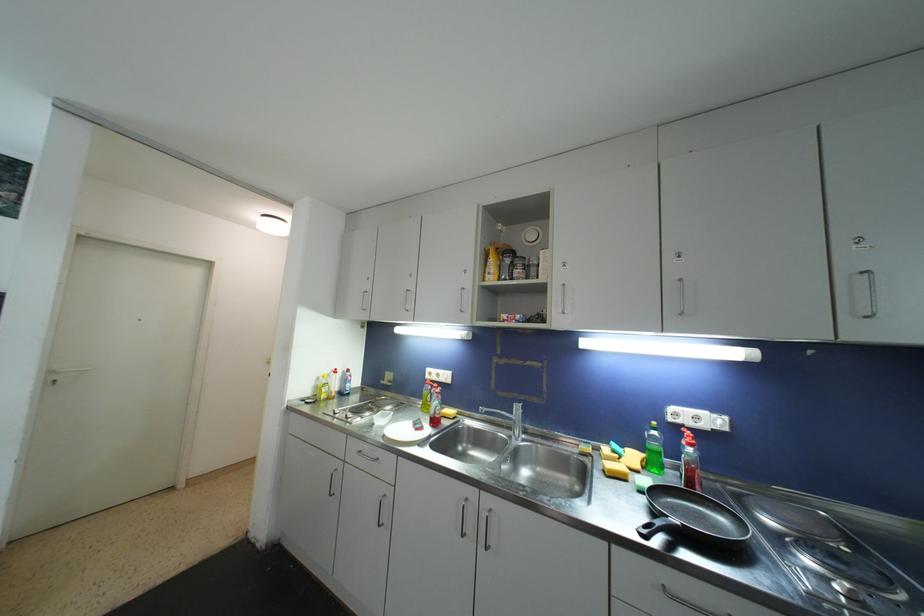
The image size is (924, 616). What do you see at coordinates (66, 381) in the screenshot? I see `a white door handle` at bounding box center [66, 381].